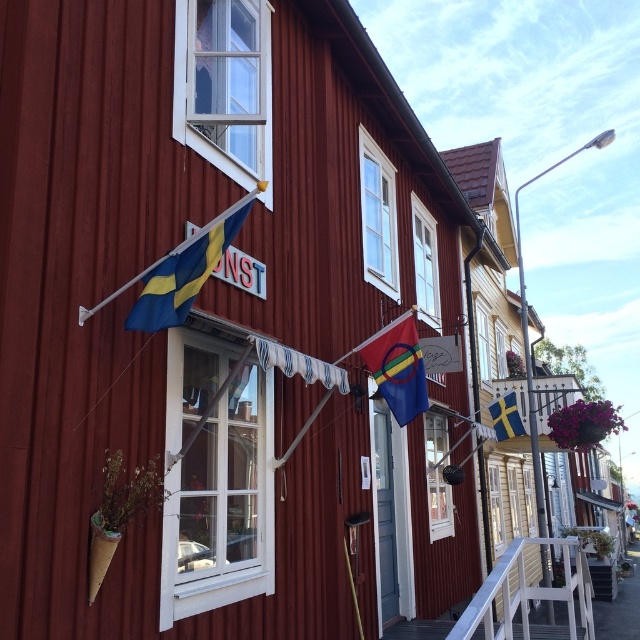
Which is in front, point (150, 326) or point (508, 392)?

Positioned in front is point (150, 326).

Who is lower down, blue/yellow fabric flag at upper left or blue and yellow fabric flag at upper right?

Positioned lower is blue and yellow fabric flag at upper right.

Is point (164, 268) farther from viewer compared to point (509, 392)?

No, (164, 268) is closer to viewer.

Image resolution: width=640 pixels, height=640 pixels. Find the location of `blue/yellow fabric flag at upper left`. blue/yellow fabric flag at upper left is located at coordinates (180, 276).

Measure the distance from blue/yellow fabric flag at upper left to reddish-brown fabric flag at center.

blue/yellow fabric flag at upper left is 10.58 feet from reddish-brown fabric flag at center.

Which of these two, blue/yellow fabric flag at upper left or reddish-brown fabric flag at center, stands taller?

With more height is reddish-brown fabric flag at center.

What do you see at coordinates (180, 276) in the screenshot? Image resolution: width=640 pixels, height=640 pixels. I see `blue/yellow fabric flag at upper left` at bounding box center [180, 276].

At what (x,y) coordinates should I click in order to perform the action: click on blue/yellow fabric flag at upper left. Please return your answer as a coordinate pair (x, y). This screenshot has width=640, height=640. Looking at the image, I should click on (180, 276).

Can you confirm if reddish-brown fabric flag at center is positioned to the right of blue and yellow fabric flag at upper right?

In fact, reddish-brown fabric flag at center is to the left of blue and yellow fabric flag at upper right.

Is reddish-brown fabric flag at center positioned behind blue and yellow fabric flag at upper right?

No, reddish-brown fabric flag at center is closer to the viewer.

This screenshot has height=640, width=640. I want to click on reddish-brown fabric flag at center, so click(397, 368).